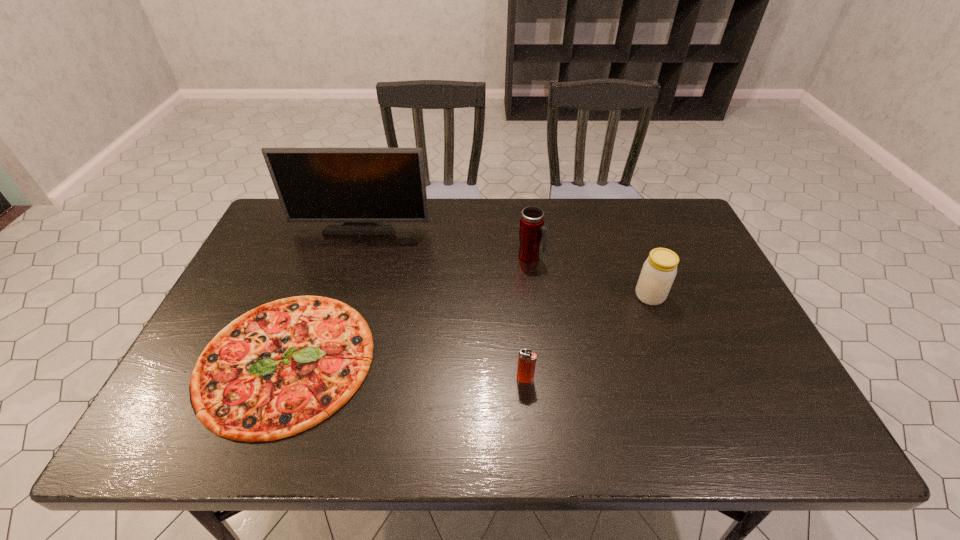
What are the coordinates of `unoccupied area between the shortest object and the rightmost object` in the screenshot? It's located at (468, 328).

The height and width of the screenshot is (540, 960). Identify the location of vacant point located between the farthest object and the second shortest object. (444, 302).

At what (x,y) coordinates should I click in order to perform the action: click on free point between the rightmost object and the thermos bottle. Please return your answer as a coordinate pair (x, y). The width and height of the screenshot is (960, 540). Looking at the image, I should click on (590, 276).

Locate an element on the screen. This screenshot has height=540, width=960. the fourth closest object relative to the tallest object is located at coordinates (659, 270).

Find the location of a particular element. This screenshot has width=960, height=540. the closest object relative to the shortest object is located at coordinates (360, 190).

Identify the location of vacant space that satisfies the following two spatial constraints: 1. on the screen side of the igniter; 2. on the right side of the tallest object. (313, 380).

You are a GUI agent. You are given a task and a screenshot of the screen. Output one action in this format:
    pyautogui.click(x=<x>, y=<y>)
    Task: Click on the vacant point that satisfies the following two spatial constraints: 1. on the side with the handle of the thermos bottle; 2. on the back side of the jar
    
    Given the screenshot: What is the action you would take?
    pyautogui.click(x=535, y=296)

Where is `free region that satisfies the following two spatial constraints: 1. on the front side of the igniter; 2. on the left side of the pizza`? The height and width of the screenshot is (540, 960). free region that satisfies the following two spatial constraints: 1. on the front side of the igniter; 2. on the left side of the pizza is located at coordinates (278, 380).

Image resolution: width=960 pixels, height=540 pixels. What are the coordinates of `blank space that satisfies the following two spatial constraints: 1. on the screen side of the tallest object; 2. on the right side of the second shortest object` in the screenshot? It's located at (313, 380).

This screenshot has height=540, width=960. Identify the location of free space that satisfies the following two spatial constraints: 1. on the screen side of the igniter; 2. on the right side of the tallest object. (313, 380).